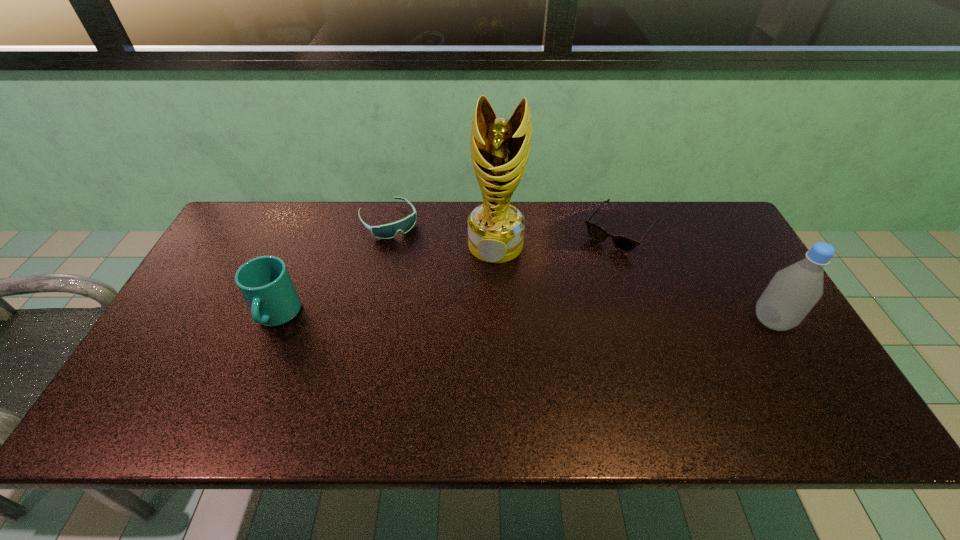
Choose which object is the fourth nearest neighbor to the bottle. Please provide its 2D coordinates. Your answer should be formatted as a tuple, i.e. [(x, y)], where the tuple contains the x and y coordinates of a point satisfying the conditions above.

[(265, 283)]

This screenshot has height=540, width=960. Find the location of `object that can be found as the third closest to the rightmost object`. object that can be found as the third closest to the rightmost object is located at coordinates (387, 231).

At what (x,y) coordinates should I click in order to perform the action: click on vacant space that satisfies the following two spatial constraints: 1. on the front side of the second tallest object; 2. on the left side of the third object from left to right. Please return your answer as a coordinate pair (x, y). Looking at the image, I should click on (498, 321).

Identify the location of blank area in the image that satisfies the following two spatial constraints: 1. on the handle side of the second tallest object; 2. on the right side of the cup. (275, 321).

At what (x,y) coordinates should I click in order to perform the action: click on free spot that satisfies the following two spatial constraints: 1. on the front side of the sunglasses; 2. on the right side of the fourth object from right to left. Please return your answer as a coordinate pair (x, y). This screenshot has width=960, height=540. Looking at the image, I should click on (386, 231).

Identify the location of vacant space that satisfies the following two spatial constraints: 1. on the front side of the fourth object from right to left; 2. on the left side of the second object from right to left. The height and width of the screenshot is (540, 960). (386, 231).